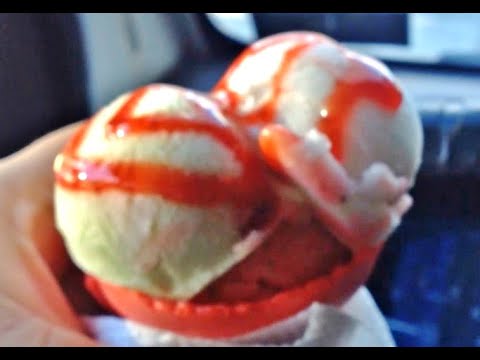
This screenshot has height=360, width=480. Identify the location of window. pos(449,31).